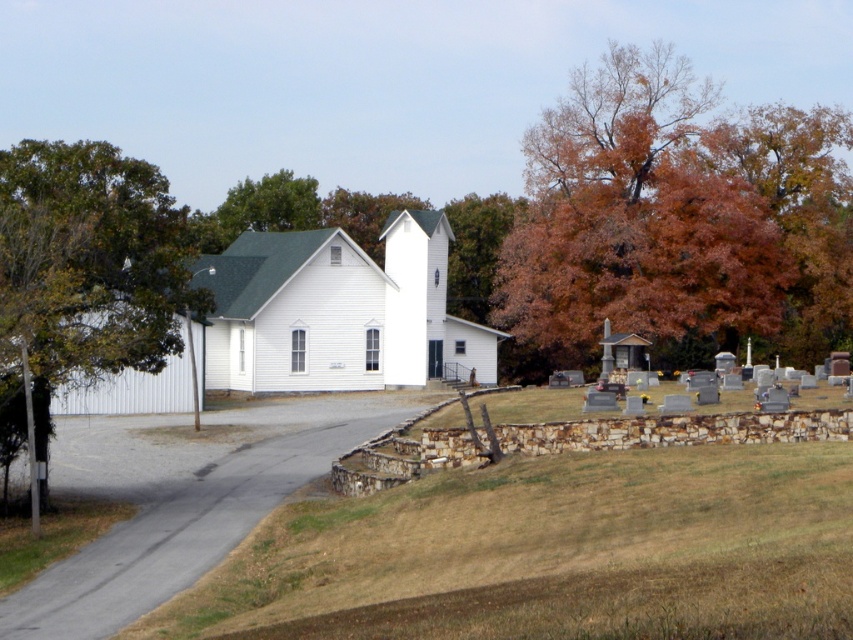
Is autumn leaves at right smaller than green leafy tree at upper left?

Actually, autumn leaves at right might be larger than green leafy tree at upper left.

Is point (653, 216) farther from camera compared to point (227, 221)?

No, (653, 216) is in front of (227, 221).

In order to click on autumn leaves at right in this screenshot , I will do `click(677, 216)`.

Does white wood church at center have a greater height compared to green leafy tree at upper left?

No.

Does white wood church at center have a lesser width compared to green leafy tree at upper left?

No, white wood church at center is not thinner than green leafy tree at upper left.

Find the location of a particular element. white wood church at center is located at coordinates (312, 321).

Does white wood church at center have a lesser height compared to green leafy tree at left?

No.

Is point (244, 269) positioned before point (144, 232)?

No, it is behind (144, 232).

Which is in front, point (476, 324) or point (157, 300)?

Point (157, 300) is more forward.

The height and width of the screenshot is (640, 853). Identify the location of white wood church at center. (312, 321).